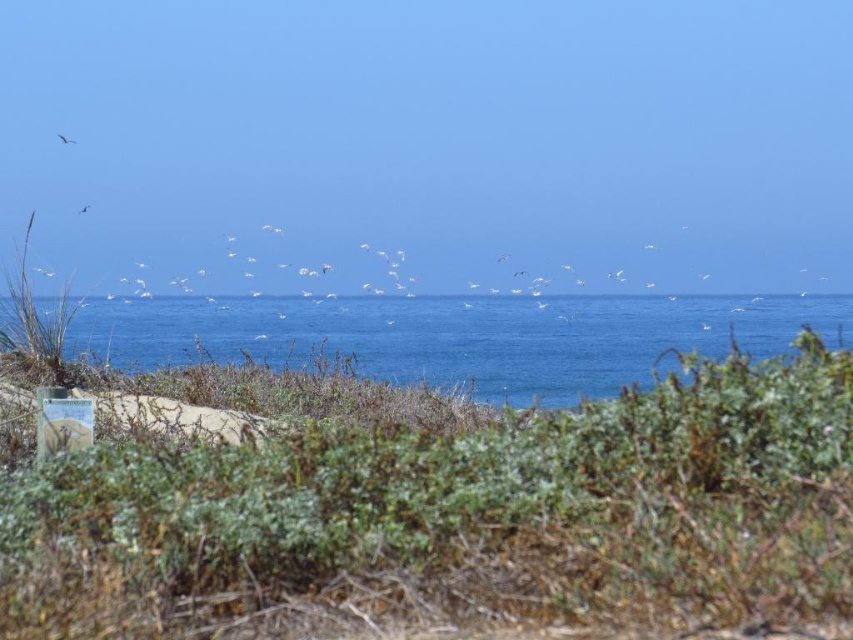
Which of these two, green shrubbery at center or white feathered bird at upper center, stands shorter?

white feathered bird at upper center

Which is below, green shrubbery at center or white feathered bird at upper center?

green shrubbery at center is lower down.

You are a GUI agent. You are given a task and a screenshot of the screen. Output one action in this format:
    pyautogui.click(x=<x>, y=<y>)
    Task: Click on the green shrubbery at center
    The width and height of the screenshot is (853, 640).
    Given the screenshot: What is the action you would take?
    pyautogui.click(x=457, y=516)

Is the position of blue water at center less distant than that of white feathered bird at upper left?

Yes, blue water at center is in front of white feathered bird at upper left.

Who is taller, blue water at center or white feathered bird at upper left?

blue water at center is taller.

Between point (268, 316) and point (80, 211), which one is positioned behind?

The point (268, 316) is behind.

Locate an element on the screen. blue water at center is located at coordinates (459, 336).

Does blue water at center have a smaller size compared to white feathered bird at upper center?

No, blue water at center is not smaller than white feathered bird at upper center.

Is point (543, 326) closer to viewer compared to point (61, 140)?

No.

What do you see at coordinates (459, 336) in the screenshot? The height and width of the screenshot is (640, 853). I see `blue water at center` at bounding box center [459, 336].

Find the location of a particular element. The height and width of the screenshot is (640, 853). blue water at center is located at coordinates (459, 336).